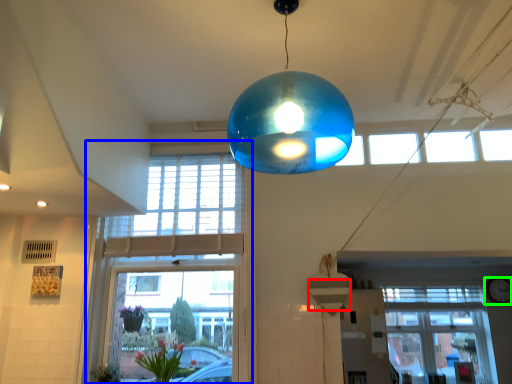
Question: Which object is the closest to the lampshade (highlighted by a red box)? Choose among these: window (highlighted by a blue box) or clock (highlighted by a green box).

Choices:
 (A) window
 (B) clock

Answer: (A)